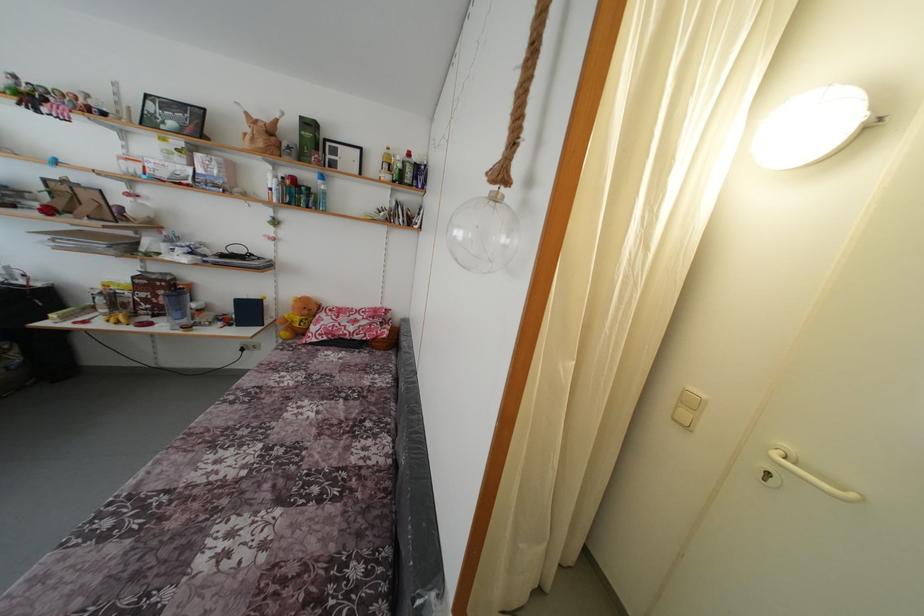
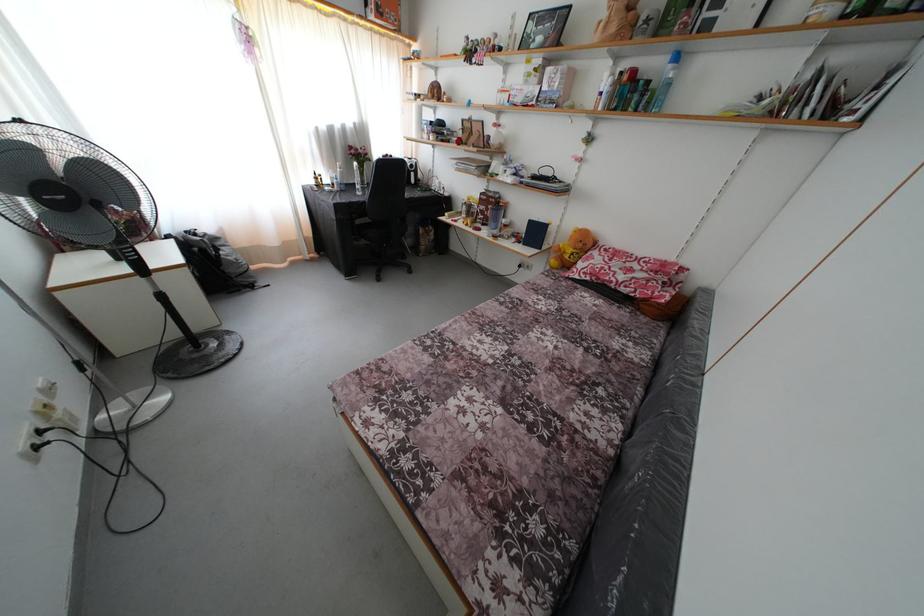
Locate, in the second image, the point that corresponds to point (398, 374) in the first image.

(663, 353)